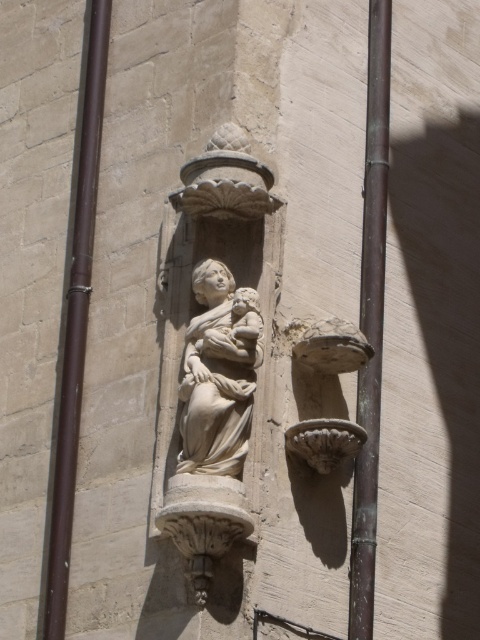
Is point (374, 204) positioned in front of point (220, 467)?

No, (374, 204) is further to viewer.

Locate an element on the screen. bronze metallic pole at center is located at coordinates (371, 321).

This screenshot has width=480, height=640. Find the location of `bronze metallic pole at center`. bronze metallic pole at center is located at coordinates (371, 321).

Does brown metal pole at left appear on the right side of bronze metallic pole at center?

Incorrect, brown metal pole at left is not on the right side of bronze metallic pole at center.

Between point (73, 376) and point (357, 520), which one is positioned in front?

Point (357, 520) is in front.

Is point (46, 605) less distant than point (349, 621)?

No, it is not.

Where is `brown metal pole at left`? brown metal pole at left is located at coordinates (73, 323).

Can you confirm if brown metal pole at left is shorter than white marble statue at center?

No.

Find the location of a particular element. The width and height of the screenshot is (480, 640). brown metal pole at left is located at coordinates (73, 323).

You are a GUI agent. You are given a task and a screenshot of the screen. Output one action in this format:
    pyautogui.click(x=<x>, y=<y>)
    Task: Click on the brown metal pole at left
    The width and height of the screenshot is (480, 640).
    Given the screenshot: What is the action you would take?
    pyautogui.click(x=73, y=323)